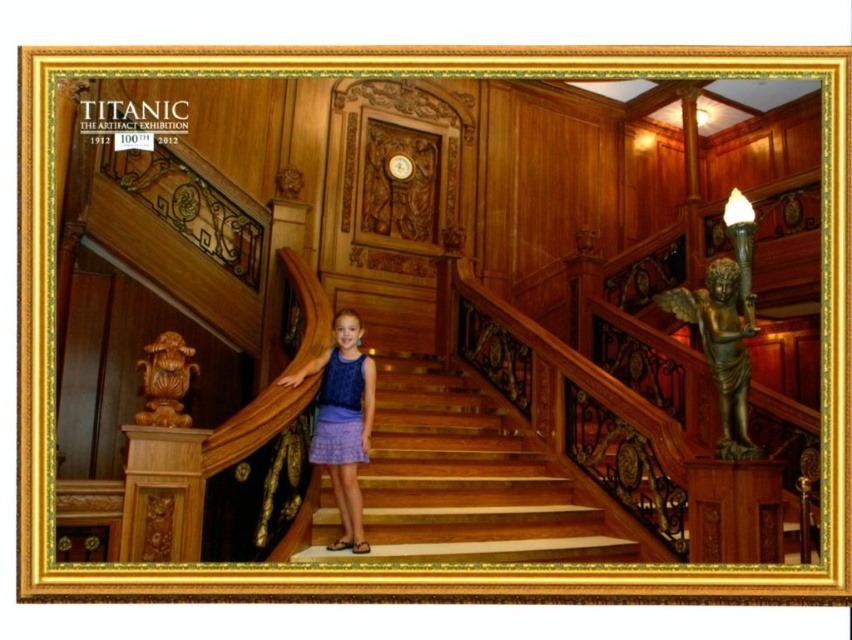
Question: Which of the following is the farthest from the observer?

Choices:
 (A) wooden stairs at center
 (B) lavender fabric skirt at center

Answer: (B)

Question: Does wooden stairs at center have a lesser width compared to lavender fabric skirt at center?

Choices:
 (A) no
 (B) yes

Answer: (A)

Question: Can you confirm if wooden stairs at center is bigger than lavender fabric skirt at center?

Choices:
 (A) yes
 (B) no

Answer: (A)

Question: Can you confirm if wooden stairs at center is positioned above lavender fabric skirt at center?

Choices:
 (A) yes
 (B) no

Answer: (B)

Question: Which of the following is the closest to the observer?

Choices:
 (A) wooden stairs at center
 (B) lavender fabric skirt at center

Answer: (A)

Question: Which point appears closest to the camera in this image?

Choices:
 (A) (346, 435)
 (B) (589, 492)

Answer: (A)